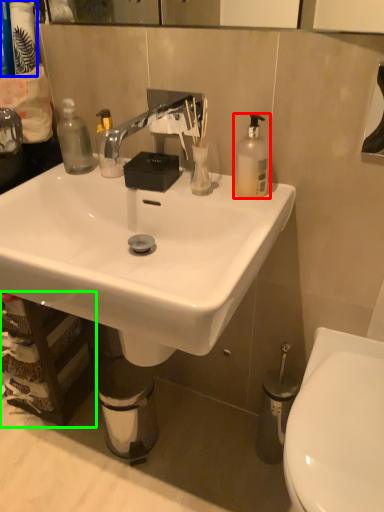
Question: Which object is the closest to the bottle (highlighted by a red box)? Choose among these: toiletries (highlighted by a blue box) or cabinetry (highlighted by a green box).

Choices:
 (A) toiletries
 (B) cabinetry

Answer: (A)